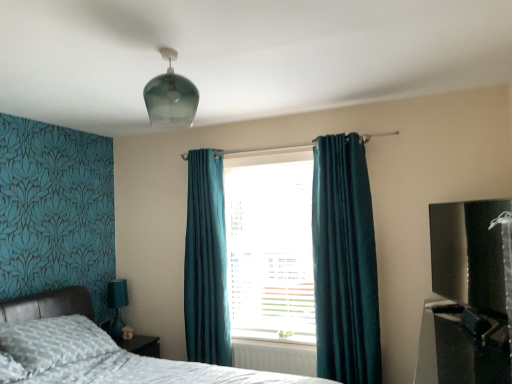
Locate an element on the screen. transparent glass light fixture at upper center is located at coordinates (170, 97).

What do you see at coordinates (275, 357) in the screenshot? The height and width of the screenshot is (384, 512). I see `white plastic radiator at lower center` at bounding box center [275, 357].

This screenshot has width=512, height=384. Describe the element at coordinates (206, 262) in the screenshot. I see `teal velvet curtain at center, positioned as the first curtain in left-to-right order` at that location.

Looking at this image, what is the approximate height of teal velvet curtain at center, the 2th curtain from the front?

The height of teal velvet curtain at center, the 2th curtain from the front, is 1.78 meters.

Where is `teal fabric lampshade at lower left`? The image size is (512, 384). teal fabric lampshade at lower left is located at coordinates (117, 304).

From a real-world perspective, is patterned fabric bed at lower left on transparent glass light fixture at upper center?

Incorrect, from a real-world perspective, patterned fabric bed at lower left is lower than transparent glass light fixture at upper center.

Which object is further away from the camera taking this photo, patterned fabric bed at lower left or transparent glass light fixture at upper center?

Positioned behind is transparent glass light fixture at upper center.

Based on the photo, is patterned fabric bed at lower left directly adjacent to transparent glass light fixture at upper center?

They are not placed beside each other.

Which is more to the left, black glossy tv at right, which is the first entertainment center from top to bottom, or teal fabric curtain at center?

From the viewer's perspective, teal fabric curtain at center appears more on the left side.

Is black glossy tv at right, marked as the 2th entertainment center in a bottom-to-top arrangement, directly adjacent to teal fabric curtain at center?

No, black glossy tv at right, marked as the 2th entertainment center in a bottom-to-top arrangement, is not beside teal fabric curtain at center.

Can you tell me how much black glossy tv at right, which is the first entertainment center from top to bottom, and teal fabric curtain at center differ in facing direction?

There is a 66.6-degree angle between the facing directions of black glossy tv at right, which is the first entertainment center from top to bottom, and teal fabric curtain at center.

Which of these two, transparent glass light fixture at upper center or black plastic entertainment center at lower right, which is counted as the 1th entertainment center, starting from the bottom, is thinner?

With smaller width is transparent glass light fixture at upper center.

Locate an element on the screen. The height and width of the screenshot is (384, 512). light fixture above the black plastic entertainment center at lower right, which is counted as the 1th entertainment center, starting from the bottom (from the image's perspective) is located at coordinates click(x=170, y=97).

Looking at this image, between transparent glass light fixture at upper center and black plastic entertainment center at lower right, which is the second entertainment center from top to bottom, which one appears on the right side from the viewer's perspective?

black plastic entertainment center at lower right, which is the second entertainment center from top to bottom.

Can black plastic entertainment center at lower right, which is the second entertainment center from top to bottom, be found inside transparent glass light fixture at upper center?

No, black plastic entertainment center at lower right, which is the second entertainment center from top to bottom, is not surrounded by transparent glass light fixture at upper center.

Considering the relative sizes of teal velvet curtain at center, the second curtain positioned from the back, and transparent glass light fixture at upper center in the image provided, is teal velvet curtain at center, the second curtain positioned from the back, thinner than transparent glass light fixture at upper center?

Indeed, teal velvet curtain at center, the second curtain positioned from the back, has a lesser width compared to transparent glass light fixture at upper center.

Can you confirm if teal velvet curtain at center, the second curtain positioned from the back, is shorter than transparent glass light fixture at upper center?

In fact, teal velvet curtain at center, the second curtain positioned from the back, may be taller than transparent glass light fixture at upper center.

Is teal velvet curtain at center, the 1th curtain positioned from the right, turned away from transparent glass light fixture at upper center?

No, teal velvet curtain at center, the 1th curtain positioned from the right, is not facing the opposite direction of transparent glass light fixture at upper center.

Where is `the 2nd curtain in front when counting from the teal fabric lampshade at lower left`? the 2nd curtain in front when counting from the teal fabric lampshade at lower left is located at coordinates (344, 263).

Which is behind, teal fabric lampshade at lower left or teal velvet curtain at center, placed as the second curtain when sorted from left to right?

teal fabric lampshade at lower left is further away from the camera.

Considering the sizes of objects teal fabric lampshade at lower left and teal velvet curtain at center, placed as the second curtain when sorted from left to right, in the image provided, who is shorter, teal fabric lampshade at lower left or teal velvet curtain at center, placed as the second curtain when sorted from left to right,?

With less height is teal fabric lampshade at lower left.

From the image's perspective, which is below, teal fabric curtain at center or teal velvet curtain at center, arranged as the first curtain when viewed from the front?

From the image's view, teal velvet curtain at center, arranged as the first curtain when viewed from the front, is below.

Can you confirm if teal fabric curtain at center is thinner than teal velvet curtain at center, placed as the second curtain when sorted from left to right?

No, teal fabric curtain at center is not thinner than teal velvet curtain at center, placed as the second curtain when sorted from left to right.

Is teal fabric curtain at center inside the boundaries of teal velvet curtain at center, the second curtain positioned from the back, or outside?

teal fabric curtain at center lies outside teal velvet curtain at center, the second curtain positioned from the back.

From a real-world perspective, which is physically above, teal fabric curtain at center or teal velvet curtain at center, arranged as the first curtain when viewed from the front?

In real-world perspective, teal fabric curtain at center is above.

Considering the relative positions of teal velvet curtain at center, arranged as the first curtain when viewed from the front, and teal fabric lampshade at lower left in the image provided, is teal velvet curtain at center, arranged as the first curtain when viewed from the front, to the right of teal fabric lampshade at lower left from the viewer's perspective?

Yes.

From a real-world perspective, is teal velvet curtain at center, arranged as the first curtain when viewed from the front, above or below teal fabric lampshade at lower left?

From a real-world perspective, teal velvet curtain at center, arranged as the first curtain when viewed from the front, is physically above teal fabric lampshade at lower left.

What's the angular difference between teal velvet curtain at center, placed as the second curtain when sorted from left to right, and teal fabric lampshade at lower left's facing directions?

The angle between the facing direction of teal velvet curtain at center, placed as the second curtain when sorted from left to right, and the facing direction of teal fabric lampshade at lower left is 89.6 degrees.

Identify the location of bed in front of the transparent glass light fixture at upper center. (158, 372).

Where is `entertainment center located above the teal fabric curtain at center (from the image's perspective)`? The image size is (512, 384). entertainment center located above the teal fabric curtain at center (from the image's perspective) is located at coordinates (465, 297).

Based on their spatial positions, is black plastic entertainment center at lower right, which is the second entertainment center from top to bottom, or white plastic radiator at lower center closer to teal velvet curtain at center, the second curtain positioned from the back?

The object closer to teal velvet curtain at center, the second curtain positioned from the back, is white plastic radiator at lower center.

Considering their positions, is black plastic entertainment center at lower right, which is counted as the 1th entertainment center, starting from the bottom, positioned further to white plastic radiator at lower center than teal fabric lampshade at lower left?

black plastic entertainment center at lower right, which is counted as the 1th entertainment center, starting from the bottom, lies further to white plastic radiator at lower center than the other object.

Consider the image. Looking at the image, which one is located closer to black glossy tv at right, which is the first entertainment center from top to bottom, black plastic entertainment center at lower right, which is counted as the 1th entertainment center, starting from the bottom, or teal fabric lampshade at lower left?

black plastic entertainment center at lower right, which is counted as the 1th entertainment center, starting from the bottom, is closer to black glossy tv at right, which is the first entertainment center from top to bottom.

Considering their positions, is black glossy tv at right, which is the first entertainment center from top to bottom, positioned further to black plastic entertainment center at lower right, which is the second entertainment center from top to bottom, than teal velvet curtain at center, arranged as the first curtain when viewed from the front?

teal velvet curtain at center, arranged as the first curtain when viewed from the front, lies further to black plastic entertainment center at lower right, which is the second entertainment center from top to bottom, than the other object.

Based on their spatial positions, is teal velvet curtain at center, the 1th curtain positioned from the right, or transparent glass light fixture at upper center closer to black plastic entertainment center at lower right, which is counted as the 1th entertainment center, starting from the bottom?

Among the two, teal velvet curtain at center, the 1th curtain positioned from the right, is located nearer to black plastic entertainment center at lower right, which is counted as the 1th entertainment center, starting from the bottom.

Looking at the image, which one is located closer to teal fabric lampshade at lower left, teal fabric curtain at center or transparent glass light fixture at upper center?

teal fabric curtain at center lies closer to teal fabric lampshade at lower left than the other object.

Looking at the image, which one is located further to teal fabric lampshade at lower left, teal velvet curtain at center, which is the first curtain in back-to-front order, or transparent glass light fixture at upper center?

transparent glass light fixture at upper center is positioned further to the anchor teal fabric lampshade at lower left.

From the image, which object appears to be farther from black plastic entertainment center at lower right, which is counted as the 1th entertainment center, starting from the bottom, white plastic radiator at lower center or patterned fabric bed at lower left?

Based on the image, patterned fabric bed at lower left appears to be further to black plastic entertainment center at lower right, which is counted as the 1th entertainment center, starting from the bottom.

I want to click on curtain positioned between black plastic entertainment center at lower right, which is counted as the 1th entertainment center, starting from the bottom, and teal fabric curtain at center from near to far, so click(344, 263).

The image size is (512, 384). In order to click on curtain located between black plastic entertainment center at lower right, which is counted as the 1th entertainment center, starting from the bottom, and teal velvet curtain at center, which is the first curtain in back-to-front order, in the depth direction in this screenshot , I will do `click(344, 263)`.

You are a GUI agent. You are given a task and a screenshot of the screen. Output one action in this format:
    pyautogui.click(x=<x>, y=<y>)
    Task: Click on the entertainment center between black plastic entertainment center at lower right, which is the second entertainment center from top to bottom, and teal fabric curtain at center, along the z-axis
    
    Given the screenshot: What is the action you would take?
    pyautogui.click(x=465, y=297)

The width and height of the screenshot is (512, 384). What are the coordinates of `curtain positioned between patterned fabric bed at lower left and white plastic radiator at lower center from near to far` in the screenshot? It's located at (344, 263).